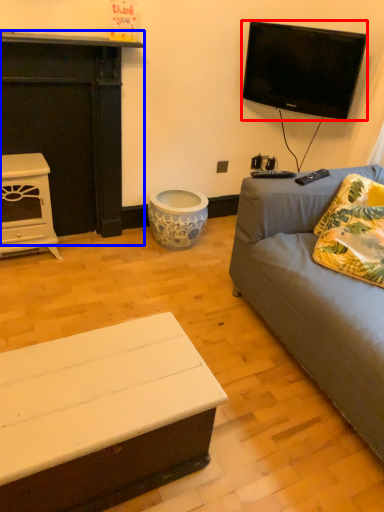
Question: Which object appears farthest to the camera in this image, television (highlighted by a red box) or fireplace (highlighted by a blue box)?

Choices:
 (A) television
 (B) fireplace

Answer: (A)